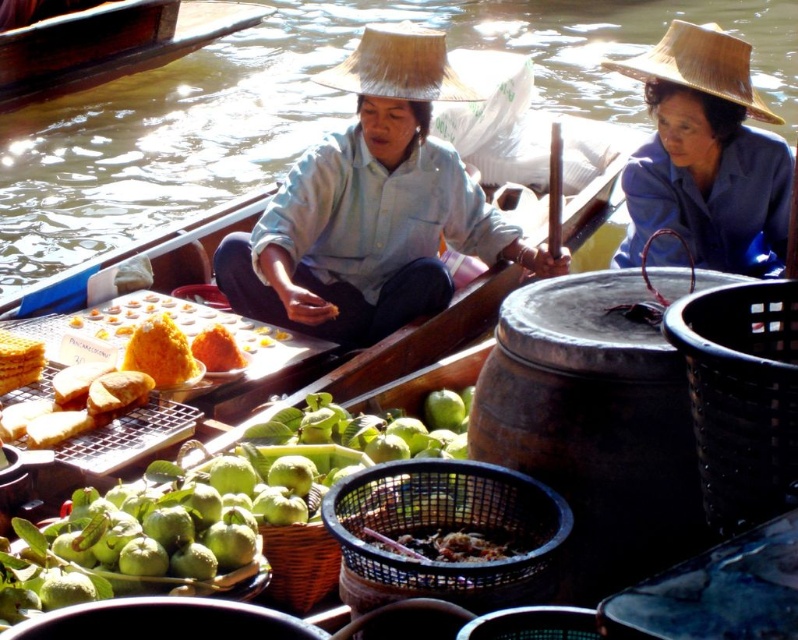
Is matte light blue shirt at center to the left of blue fabric hat at upper right from the viewer's perspective?

Correct, you'll find matte light blue shirt at center to the left of blue fabric hat at upper right.

Between matte light blue shirt at center and blue fabric hat at upper right, which one is positioned lower?

matte light blue shirt at center is lower down.

Describe the element at coordinates (372, 208) in the screenshot. This screenshot has height=640, width=798. I see `matte light blue shirt at center` at that location.

The height and width of the screenshot is (640, 798). Identify the location of matte light blue shirt at center. (372, 208).

Is black woven basket at lower right positioned at the back of orange soft bread at center?

No, black woven basket at lower right is in front of orange soft bread at center.

Is black woven basket at lower right shorter than orange soft bread at center?

In fact, black woven basket at lower right may be taller than orange soft bread at center.

Is point (773, 404) less distant than point (194, 352)?

Yes, point (773, 404) is in front of point (194, 352).

Find the location of `black woven basket at lower right`. black woven basket at lower right is located at coordinates (741, 396).

Is point (338, 228) closer to camera compared to point (656, 61)?

No, it is behind (656, 61).

Where is `matte light blue shirt at center`? The width and height of the screenshot is (798, 640). matte light blue shirt at center is located at coordinates (372, 208).